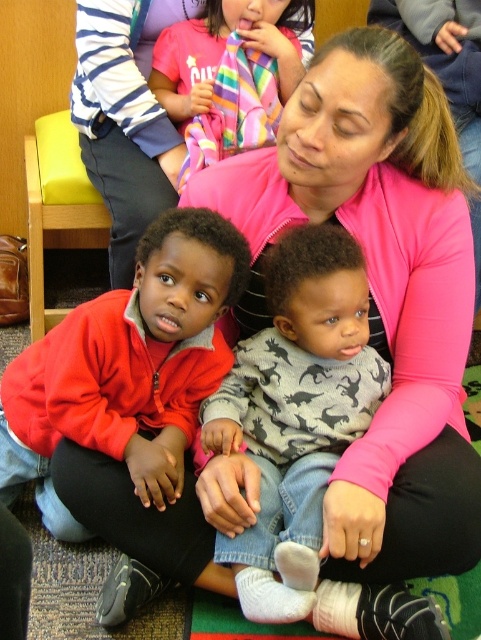
The height and width of the screenshot is (640, 481). Identify the location of red fleece jacket at center. (127, 368).

Is red fleece jacket at center positioned before gray cotton sweater at center?

No, it is not.

You are a GUI agent. You are given a task and a screenshot of the screen. Output one action in this format:
    pyautogui.click(x=<x>, y=<y>)
    Task: Click on the red fleece jacket at center
    The width and height of the screenshot is (481, 640).
    Given the screenshot: What is the action you would take?
    pyautogui.click(x=127, y=368)

Can you confirm if red fleece jacket at center is wider than pink zip-up jacket at upper center?

Yes.

Is point (154, 397) farther from viewer compared to point (87, 70)?

No, it is not.

What do you see at coordinates (127, 368) in the screenshot? I see `red fleece jacket at center` at bounding box center [127, 368].

In order to click on red fleece jacket at center in this screenshot , I will do `click(127, 368)`.

Does gray cotton sweater at center have a greater width compared to pink zip-up jacket at upper center?

Indeed, gray cotton sweater at center has a greater width compared to pink zip-up jacket at upper center.

Is point (271, 397) positioned before point (102, 172)?

That is True.

Is point (319, 509) positioned before point (143, 227)?

Yes, it is in front of point (143, 227).

What are the coordinates of `gray cotton sweater at center` in the screenshot? It's located at (295, 412).